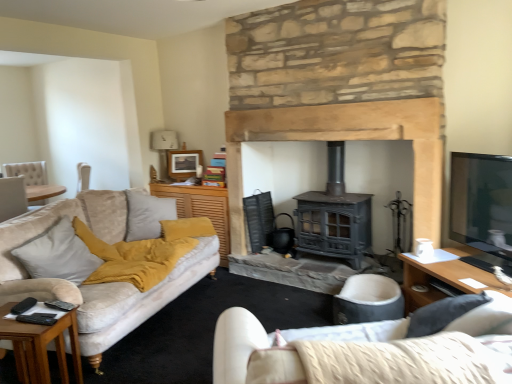
Question: Can we say wooden side table at lower left, the second table when ordered from right to left, lies outside soft beige cushion at left?

Choices:
 (A) no
 (B) yes

Answer: (B)

Question: From the image's perspective, is wooden side table at lower left, which is counted as the second table, starting from the top, below soft beige cushion at left?

Choices:
 (A) yes
 (B) no

Answer: (A)

Question: Considering the relative positions of wooden side table at lower left, the second table when ordered from right to left, and soft beige cushion at left in the image provided, is wooden side table at lower left, the second table when ordered from right to left, to the right of soft beige cushion at left from the viewer's perspective?

Choices:
 (A) yes
 (B) no

Answer: (A)

Question: From a real-world perspective, is wooden side table at lower left, which is counted as the second table, starting from the top, below soft beige cushion at left?

Choices:
 (A) yes
 (B) no

Answer: (A)

Question: Considering the relative sizes of wooden side table at lower left, the 1th table from the left, and soft beige cushion at left in the image provided, is wooden side table at lower left, the 1th table from the left, taller than soft beige cushion at left?

Choices:
 (A) yes
 (B) no

Answer: (A)

Question: Would you say matte black stove at center is to the left or to the right of yellow fabric cushion at center, which ranks as the 2th table in bottom-to-top order, in the picture?

Choices:
 (A) left
 (B) right

Answer: (B)

Question: Considering the positions of matte black stove at center and yellow fabric cushion at center, positioned as the second table in front-to-back order, in the image, is matte black stove at center wider or thinner than yellow fabric cushion at center, positioned as the second table in front-to-back order,?

Choices:
 (A) thin
 (B) wide

Answer: (A)

Question: Is matte black stove at center in front of or behind yellow fabric cushion at center, acting as the 1th table starting from the right, in the image?

Choices:
 (A) behind
 (B) front

Answer: (B)

Question: From the image's perspective, is matte black stove at center above or below yellow fabric cushion at center, acting as the 1th table starting from the right?

Choices:
 (A) above
 (B) below

Answer: (A)

Question: From a real-world perspective, is matte black stove at center physically located above or below white fabric studio couch at lower right?

Choices:
 (A) above
 (B) below

Answer: (A)

Question: Looking at their shapes, would you say matte black stove at center is wider or thinner than white fabric studio couch at lower right?

Choices:
 (A) wide
 (B) thin

Answer: (B)

Question: From their relative heights in the image, would you say matte black stove at center is taller or shorter than white fabric studio couch at lower right?

Choices:
 (A) short
 (B) tall

Answer: (B)

Question: Looking at the image, does matte black stove at center seem bigger or smaller compared to white fabric studio couch at lower right?

Choices:
 (A) small
 (B) big

Answer: (B)

Question: Relative to wooden picture frame at upper center, is soft gray fabric armchair at center in front or behind?

Choices:
 (A) behind
 (B) front

Answer: (B)

Question: Based on their positions, is soft gray fabric armchair at center located to the left or right of wooden picture frame at upper center?

Choices:
 (A) right
 (B) left

Answer: (A)